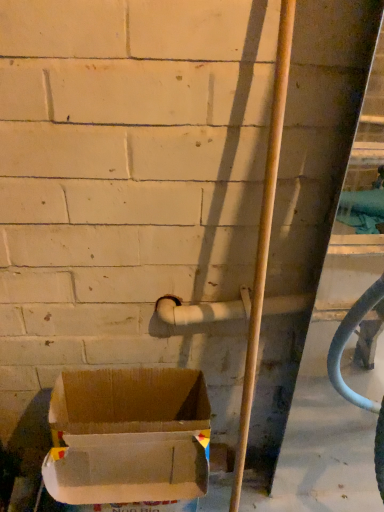
This screenshot has width=384, height=512. Identify the location of brown cardboard box at lower left. (128, 437).

Measure the distance between brown cardboard box at lower left and camera.

brown cardboard box at lower left and camera are 30.19 inches apart.

The image size is (384, 512). What do you see at coordinates (128, 437) in the screenshot? I see `brown cardboard box at lower left` at bounding box center [128, 437].

Find the location of a particular element. This screenshot has height=512, width=384. brown cardboard box at lower left is located at coordinates (128, 437).